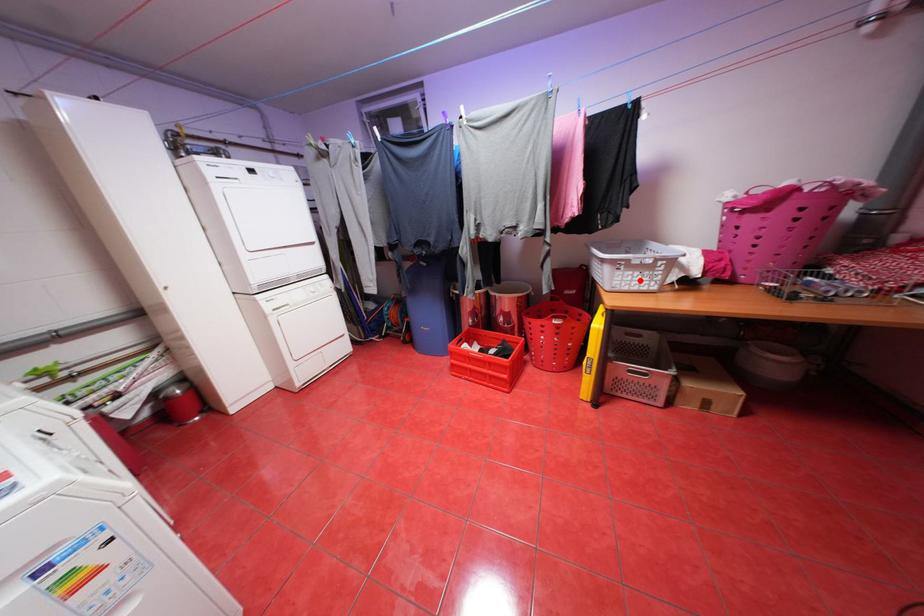
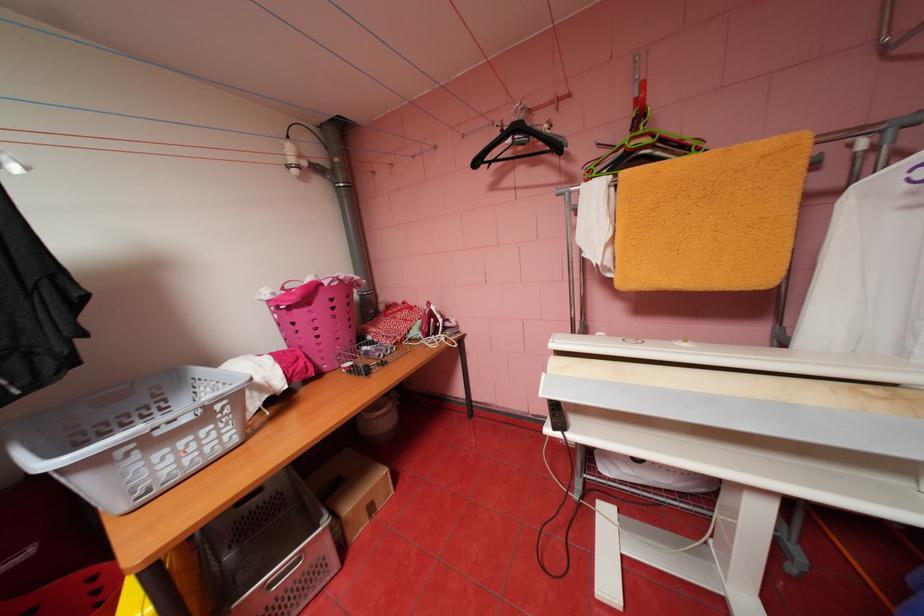
Find the pixel in the second image that matches the highlighted location in the first image.

(187, 460)